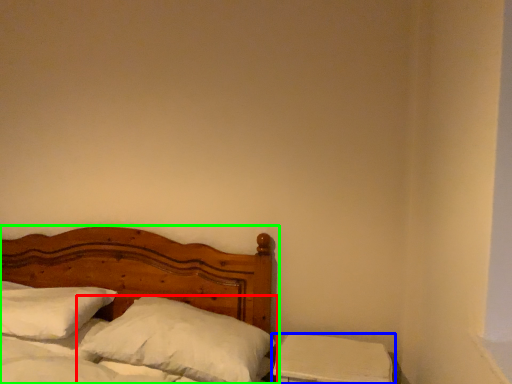
Question: Which object is positioned closest to pillow (highlighted by a red box)? Select from nightstand (highlighted by a blue box) and bed (highlighted by a green box).

Choices:
 (A) nightstand
 (B) bed

Answer: (A)